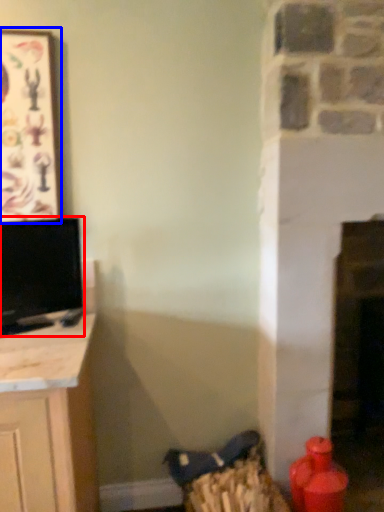
Question: Which point is closer to the camera, television (highlighted by a red box) or picture frame (highlighted by a blue box)?

Choices:
 (A) television
 (B) picture frame

Answer: (A)